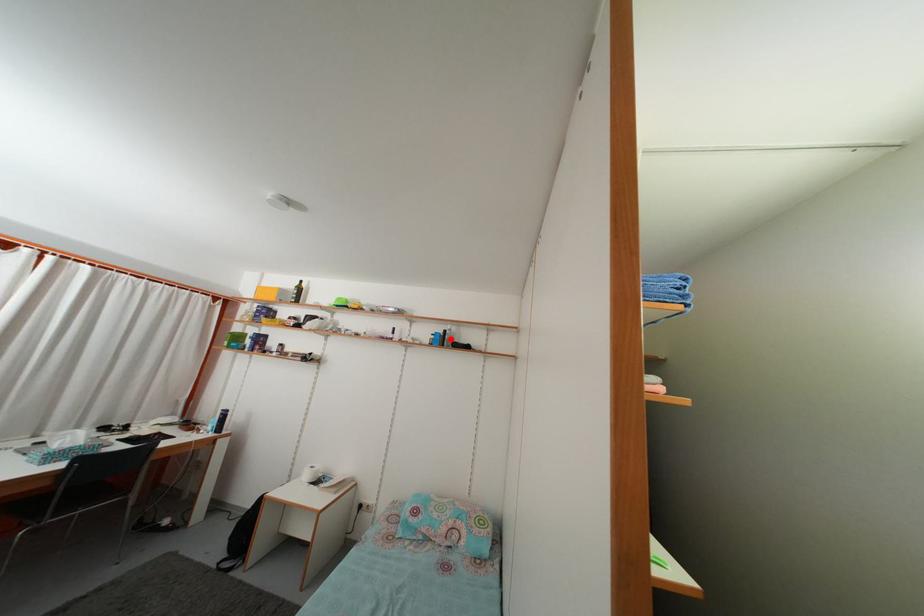
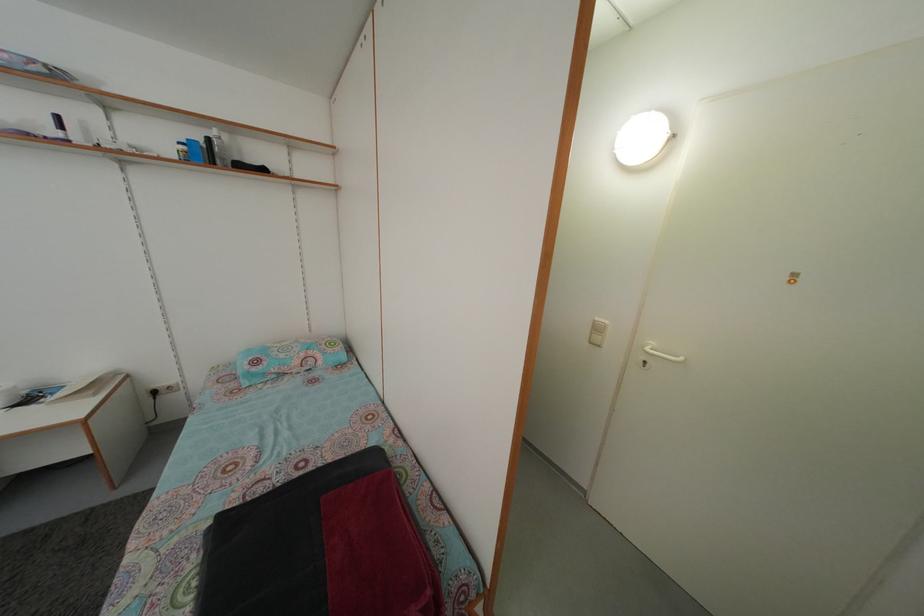
Find the pixel in the second image that matches the highlighted location in the first image.

(214, 148)